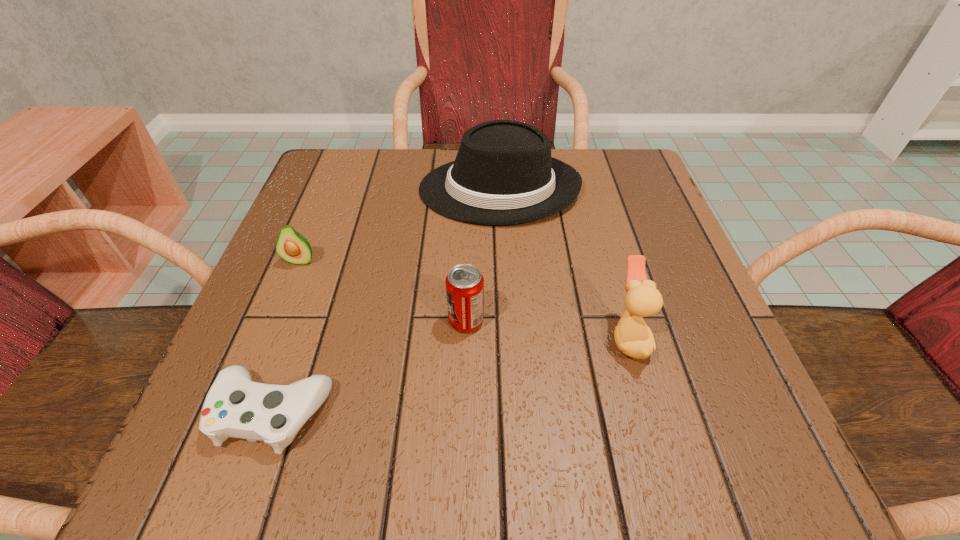
The image size is (960, 540). Find the location of `free space between the soda can and the fedora`. free space between the soda can and the fedora is located at coordinates (483, 255).

The width and height of the screenshot is (960, 540). I want to click on object identified as the second closest to the fourth tallest object, so click(x=235, y=406).

The width and height of the screenshot is (960, 540). What are the coordinates of `object that is the fourth closest to the soda can` in the screenshot? It's located at (293, 247).

Locate an element on the screen. free location that satisfies the following two spatial constraints: 1. on the cut side of the control; 2. on the right side of the fourth tallest object is located at coordinates [238, 413].

Where is `vacant space that satisfies the following two spatial constraints: 1. on the cut side of the fourth nearest object; 2. on the right side of the soda can`? The image size is (960, 540). vacant space that satisfies the following two spatial constraints: 1. on the cut side of the fourth nearest object; 2. on the right side of the soda can is located at coordinates (276, 321).

Find the location of a particular element. free space in the image that satisfies the following two spatial constraints: 1. on the front-facing side of the farthest object; 2. on the cut side of the fourth nearest object is located at coordinates (503, 261).